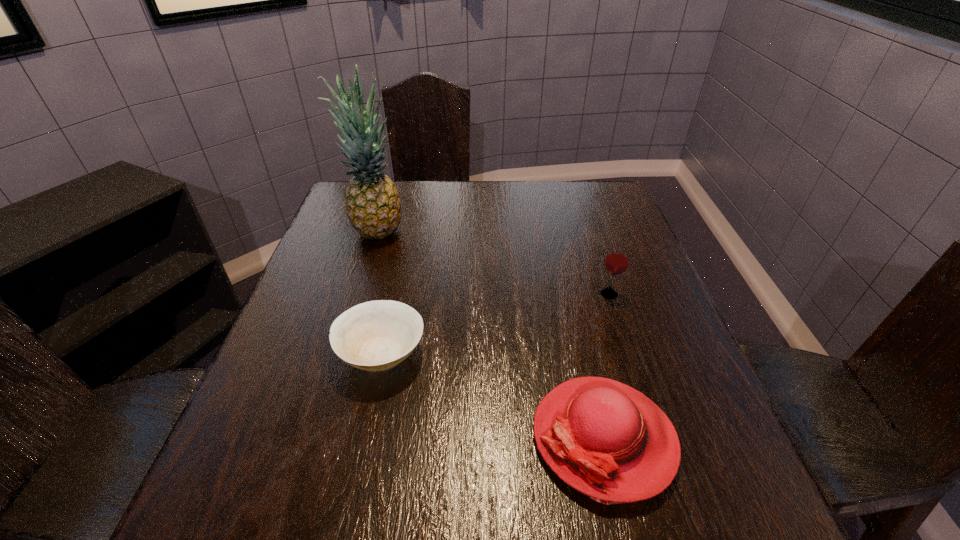
Locate an element on the screen. The image size is (960, 540). pineapple is located at coordinates (373, 206).

Locate an element on the screen. This screenshot has height=540, width=960. the tallest object is located at coordinates (373, 206).

What are the coordinates of `the third nearest object` in the screenshot? It's located at (617, 260).

You are a GUI agent. You are given a task and a screenshot of the screen. Output one action in this format:
    pyautogui.click(x=<x>, y=<y>)
    Task: Click on the third shortest object
    The height and width of the screenshot is (540, 960).
    Given the screenshot: What is the action you would take?
    pyautogui.click(x=617, y=260)

Image resolution: width=960 pixels, height=540 pixels. Identify the location of the second shortest object. (607, 440).

Identify the location of the shortest object. Image resolution: width=960 pixels, height=540 pixels. (377, 335).

You are a GUI agent. You are given a task and a screenshot of the screen. Output one action in this format:
    pyautogui.click(x=<x>, y=<y>)
    Task: Click on the vacant area situated 0.350m on the right of the pineapple
    This screenshot has width=960, height=540.
    Given the screenshot: What is the action you would take?
    pyautogui.click(x=533, y=231)

This screenshot has height=540, width=960. I want to click on vacant space situated 0.160m on the left of the second farthest object, so click(529, 294).

Find the location of a particular element. This screenshot has height=540, width=960. vacant point located 0.190m at the front of the hat with a bow is located at coordinates (420, 437).

Locate an element on the screen. The image size is (960, 540). free region located 0.370m at the front of the hat with a bow is located at coordinates (315, 437).